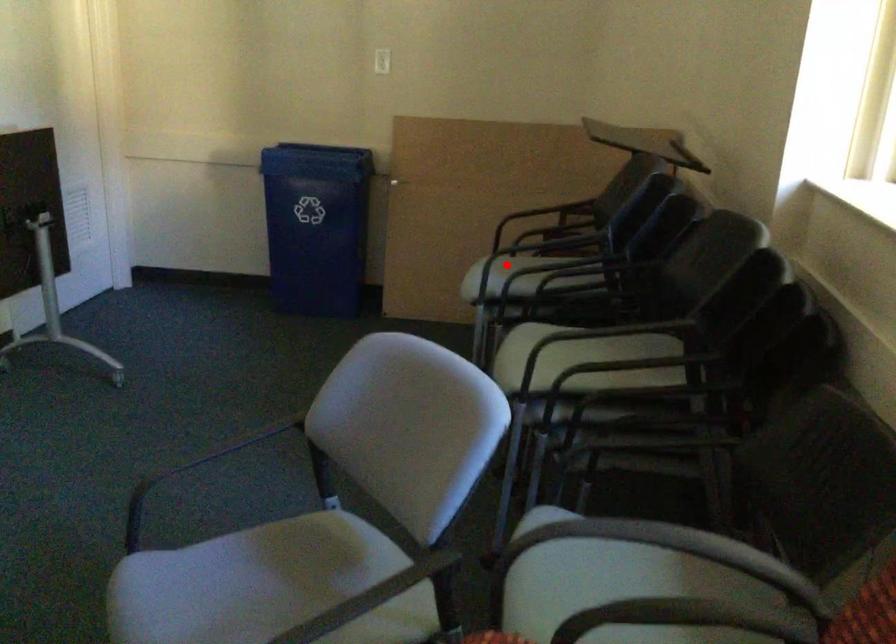
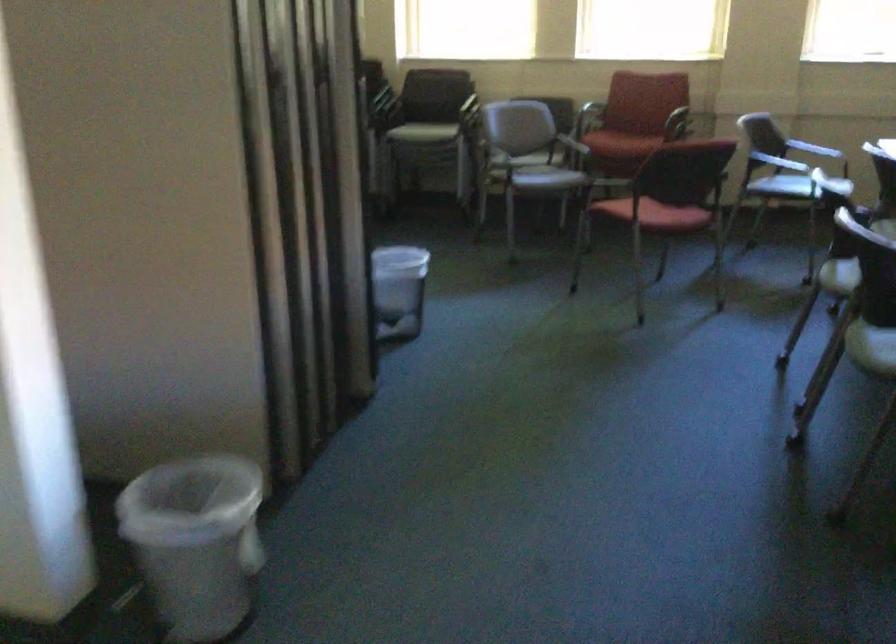
Question: I am providing you with two images of the same scene from different viewpoints. A red point is marked on the first image. Can you still see the location of the red point in image 2?

Choices:
 (A) Yes
 (B) No

Answer: (B)